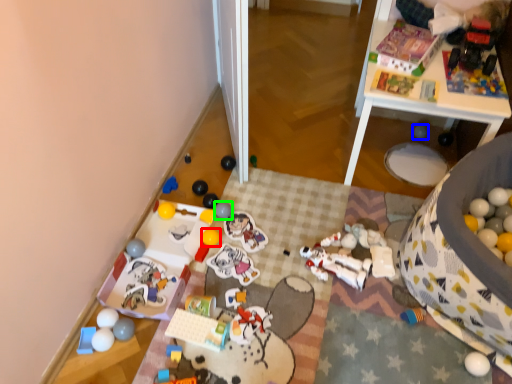
Question: Which is farther away from toy (highlighted by a red box)? toy (highlighted by a blue box) or toy (highlighted by a green box)?

Choices:
 (A) toy
 (B) toy

Answer: (A)